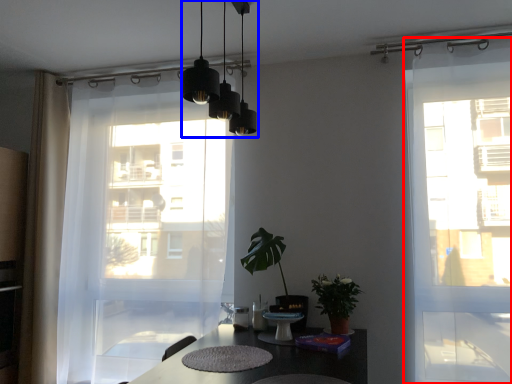
Question: Which of the following is the farthest to the observer, door (highlighted by a red box) or lighting (highlighted by a blue box)?

Choices:
 (A) door
 (B) lighting

Answer: (A)